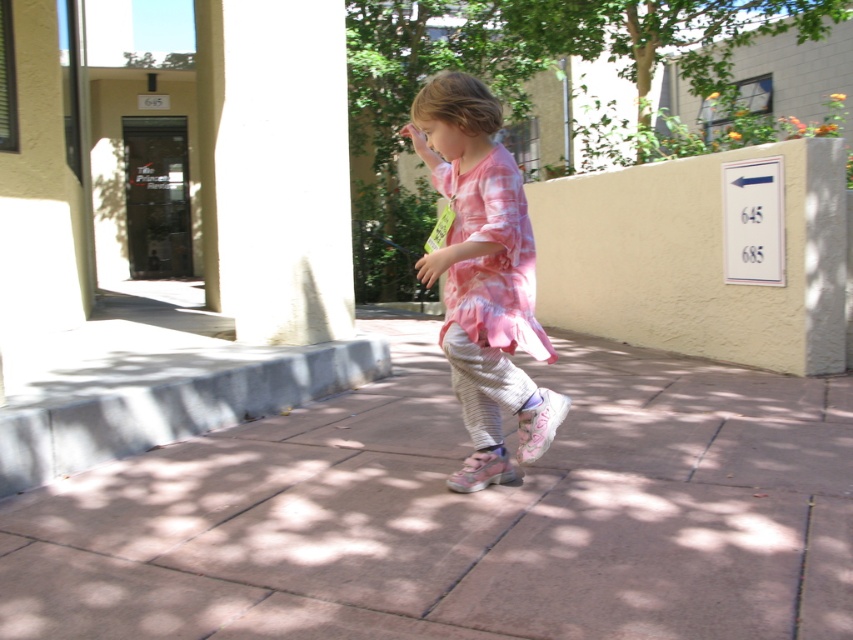
Does pink tie-dye dress at center have a greater width compared to pink fabric sandal at center?

Yes, pink tie-dye dress at center is wider than pink fabric sandal at center.

Between pink tie-dye dress at center and pink fabric sandal at center, which one has more height?

pink tie-dye dress at center

Does point (445, 179) come behind point (451, 484)?

Yes, point (445, 179) is behind point (451, 484).

I want to click on pink tie-dye dress at center, so click(492, 257).

Between pink tie-dye shirt at center and pink fabric sandal at center, which one has less height?

Standing shorter between the two is pink fabric sandal at center.

Between point (492, 417) and point (514, 476), which one is positioned in front?

Point (514, 476)

Locate an element on the screen. pink tie-dye shirt at center is located at coordinates (483, 266).

Does pink rubber shoes at center have a greater height compared to white smooth pillar at left?

No.

Between pink rubber shoes at center and white smooth pillar at left, which one is positioned lower?

Positioned lower is pink rubber shoes at center.

This screenshot has width=853, height=640. What do you see at coordinates (463, 515) in the screenshot? I see `pink rubber shoes at center` at bounding box center [463, 515].

Where is `pink rubber shoes at center`? Image resolution: width=853 pixels, height=640 pixels. pink rubber shoes at center is located at coordinates (463, 515).